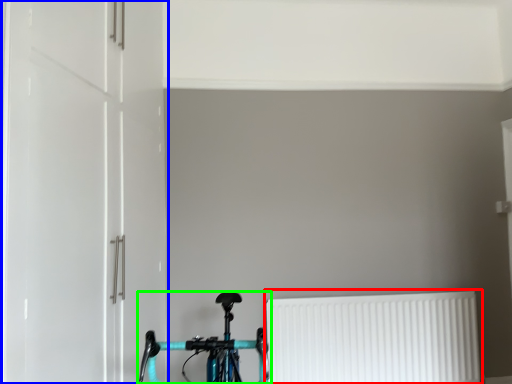
Question: Estimate the real-world distances between objects in this image. Which object is farther from radiator (highlighted by a red box), door (highlighted by a blue box) or bicycle (highlighted by a green box)?

Choices:
 (A) door
 (B) bicycle

Answer: (A)